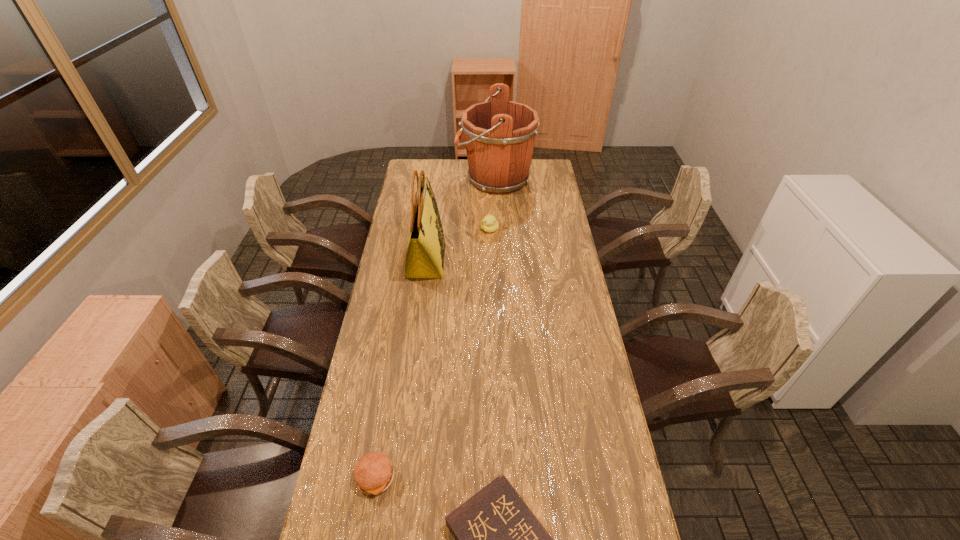
Where is `object that is at the far edge`? The image size is (960, 540). object that is at the far edge is located at coordinates (500, 135).

Find the location of `tote bag positioned at the left edge`. tote bag positioned at the left edge is located at coordinates (425, 253).

The height and width of the screenshot is (540, 960). I want to click on hamburger at the left edge, so click(373, 474).

This screenshot has height=540, width=960. I want to click on object situated at the right edge, so click(x=500, y=135).

You are a GUI agent. You are given a task and a screenshot of the screen. Output one action in this format:
    pyautogui.click(x=<x>, y=<y>)
    Task: Click on the object situated at the far right corner
    This screenshot has height=540, width=960.
    Given the screenshot: What is the action you would take?
    pyautogui.click(x=500, y=135)

At what (x,y) coordinates should I click in order to perform the action: click on free space at the far edge of the desktop. Please return your answer as a coordinate pair (x, y). This screenshot has height=540, width=960. Looking at the image, I should click on (463, 172).

What are the coordinates of `free space at the left edge` in the screenshot? It's located at (399, 203).

Find the location of a particular element. vacant space at the right edge of the desktop is located at coordinates [560, 366].

This screenshot has height=540, width=960. In order to click on vacant area that lies between the farthest object and the hamburger in this screenshot , I will do `click(435, 328)`.

The height and width of the screenshot is (540, 960). What are the coordinates of `vacant area that lies between the tote bag and the farthest object` in the screenshot? It's located at (461, 220).